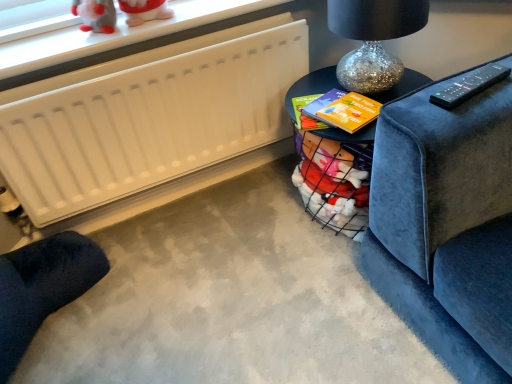
Describe the element at coordinates (312, 86) in the screenshot. I see `matte black table at upper right, which is the first table from back to front` at that location.

At what (x,y) coordinates should I click in order to perform the action: click on black glossy table at center, the first table in the front-to-back sequence. Please return your answer as a coordinate pair (x, y). Looking at the image, I should click on (312, 86).

Describe the element at coordinates (312, 86) in the screenshot. I see `black glossy table at center, the first table in the front-to-back sequence` at that location.

In order to face sparkly glass table lamp at upper right, should I rotate leftwards or rightwards?

You should look right and rotate roughly 15.676 degrees.

The image size is (512, 384). Find the location of `matte black table at upper right, which is the second table from front to back`. matte black table at upper right, which is the second table from front to back is located at coordinates (312, 86).

Consider the image. Can you tell me how much black glossy table at center, the first table in the front-to-back sequence, and matte black table at upper right, which is the second table from front to back, differ in facing direction?

black glossy table at center, the first table in the front-to-back sequence, and matte black table at upper right, which is the second table from front to back, are facing 19 degrees away from each other.

Is black glossy table at center, the first table in the front-to-back sequence, outside of matte black table at upper right, which is the second table from front to back?

Yes, black glossy table at center, the first table in the front-to-back sequence, is not within matte black table at upper right, which is the second table from front to back.

Is black glossy table at center, the first table in the front-to-back sequence, bigger or smaller than matte black table at upper right, which is the second table from front to back?

Considering their sizes, black glossy table at center, the first table in the front-to-back sequence, takes up more space than matte black table at upper right, which is the second table from front to back.

Looking at this image, who is more distant, matte black table at upper right, which is the first table from back to front, or black glossy table at center, arranged as the 2th table when viewed from the back?

matte black table at upper right, which is the first table from back to front, is behind.

From the image's perspective, is matte black table at upper right, which is the first table from back to front, located above or below black glossy table at center, the first table in the front-to-back sequence?

Clearly, from the image's perspective, matte black table at upper right, which is the first table from back to front, is above black glossy table at center, the first table in the front-to-back sequence.

Is point (324, 135) closer or farther from the camera than point (404, 81)?

Point (324, 135).

Where is `table in front of the matte black table at upper right, which is the first table from back to front`? The height and width of the screenshot is (384, 512). table in front of the matte black table at upper right, which is the first table from back to front is located at coordinates (312, 86).

Consider the image. Considering the relative positions of dark blue fabric footrest at lower left and white matte radiator at upper left in the image provided, is dark blue fabric footrest at lower left in front of white matte radiator at upper left?

Yes, it is in front of white matte radiator at upper left.

Which is closer, (51,252) or (228,102)?

Point (51,252).

Considering the relative sizes of dark blue fabric footrest at lower left and white matte radiator at upper left in the image provided, is dark blue fabric footrest at lower left smaller than white matte radiator at upper left?

Incorrect, dark blue fabric footrest at lower left is not smaller in size than white matte radiator at upper left.

Which object is thinner, sparkly glass table lamp at upper right or matte black table at upper right, which is the first table from back to front?

Thinner between the two is matte black table at upper right, which is the first table from back to front.

Between sparkly glass table lamp at upper right and matte black table at upper right, which is the second table from front to back, which one is positioned behind?

Positioned behind is matte black table at upper right, which is the second table from front to back.

From a real-world perspective, is sparkly glass table lamp at upper right physically below matte black table at upper right, which is the first table from back to front?

No, from a real-world perspective, sparkly glass table lamp at upper right is not beneath matte black table at upper right, which is the first table from back to front.

Is point (79, 278) positioned after point (373, 139)?

Yes, point (79, 278) is farther from viewer.

From a real-world perspective, relative to black glossy table at center, arranged as the 2th table when viewed from the back, is dark blue fabric footrest at lower left vertically above or below?

Clearly, from a real-world perspective, dark blue fabric footrest at lower left is above black glossy table at center, arranged as the 2th table when viewed from the back.

Where is `table that appears below the dark blue fabric footrest at lower left (from a real-world perspective)`? table that appears below the dark blue fabric footrest at lower left (from a real-world perspective) is located at coordinates (312, 86).

Consider the image. How different are the orientations of dark blue fabric footrest at lower left and black glossy table at center, arranged as the 2th table when viewed from the back, in degrees?

dark blue fabric footrest at lower left and black glossy table at center, arranged as the 2th table when viewed from the back, are facing 146 degrees away from each other.

Can we say white matte radiator at upper left lies outside sparkly glass table lamp at upper right?

Yes, white matte radiator at upper left is located beyond the bounds of sparkly glass table lamp at upper right.

Where is `radiator behind the sparkly glass table lamp at upper right`? The image size is (512, 384). radiator behind the sparkly glass table lamp at upper right is located at coordinates (149, 117).

Who is shorter, white matte radiator at upper left or sparkly glass table lamp at upper right?

sparkly glass table lamp at upper right.

Which of these two, sparkly glass table lamp at upper right or black glossy table at center, the first table in the front-to-back sequence, stands shorter?

sparkly glass table lamp at upper right.

Is sparkly glass table lamp at upper right far away from black glossy table at center, arranged as the 2th table when viewed from the back?

No, sparkly glass table lamp at upper right is in close proximity to black glossy table at center, arranged as the 2th table when viewed from the back.

Is sparkly glass table lamp at upper right facing away from black glossy table at center, arranged as the 2th table when viewed from the back?

No, black glossy table at center, arranged as the 2th table when viewed from the back, is not at the back of sparkly glass table lamp at upper right.

How much distance is there between sparkly glass table lamp at upper right and black glossy table at center, arranged as the 2th table when viewed from the back?

sparkly glass table lamp at upper right and black glossy table at center, arranged as the 2th table when viewed from the back, are 14.91 centimeters apart.

What are the coordinates of `table in front of the matte black table at upper right, which is the second table from front to back` in the screenshot? It's located at (312, 86).

Identify the location of table above the black glossy table at center, the first table in the front-to-back sequence (from the image's perspective). (312, 86).

Which object lies nearer to the anchor point dark blue fabric footrest at lower left, matte black table at upper right, which is the second table from front to back, or sparkly glass table lamp at upper right?

matte black table at upper right, which is the second table from front to back, is positioned closer to the anchor dark blue fabric footrest at lower left.

When comparing their distances from black glossy table at center, arranged as the 2th table when viewed from the back, does sparkly glass table lamp at upper right or dark blue fabric footrest at lower left seem closer?

The object closer to black glossy table at center, arranged as the 2th table when viewed from the back, is sparkly glass table lamp at upper right.

Estimate the real-world distances between objects in this image. Which object is closer to matte black table at upper right, which is the first table from back to front, white matte radiator at upper left or black glossy table at center, the first table in the front-to-back sequence?

Based on the image, black glossy table at center, the first table in the front-to-back sequence, appears to be nearer to matte black table at upper right, which is the first table from back to front.

Estimate the real-world distances between objects in this image. Which object is closer to black glossy table at center, the first table in the front-to-back sequence, white matte radiator at upper left or matte black table at upper right, which is the first table from back to front?

matte black table at upper right, which is the first table from back to front, lies closer to black glossy table at center, the first table in the front-to-back sequence, than the other object.

Which object lies further to the anchor point white matte radiator at upper left, black glossy table at center, the first table in the front-to-back sequence, or dark blue fabric footrest at lower left?

black glossy table at center, the first table in the front-to-back sequence, is further to white matte radiator at upper left.

Looking at the image, which one is located closer to dark blue fabric footrest at lower left, black glossy table at center, the first table in the front-to-back sequence, or matte black table at upper right, which is the second table from front to back?

Among the two, matte black table at upper right, which is the second table from front to back, is located nearer to dark blue fabric footrest at lower left.

Consider the image. From the image, which object appears to be nearer to black glossy table at center, the first table in the front-to-back sequence, sparkly glass table lamp at upper right or matte black table at upper right, which is the second table from front to back?

The object closer to black glossy table at center, the first table in the front-to-back sequence, is matte black table at upper right, which is the second table from front to back.

When comparing their distances from black glossy table at center, the first table in the front-to-back sequence, does sparkly glass table lamp at upper right or white matte radiator at upper left seem further?

white matte radiator at upper left is further to black glossy table at center, the first table in the front-to-back sequence.

You are a GUI agent. You are given a task and a screenshot of the screen. Output one action in this format:
    pyautogui.click(x=<x>, y=<y>)
    Task: Click on the table between sparkly glass table lamp at upper right and black glossy table at center, arranged as the 2th table when viewed from the back, vertically
    This screenshot has height=384, width=512.
    Given the screenshot: What is the action you would take?
    pyautogui.click(x=312, y=86)

Locate an element on the screen. radiator located between dark blue fabric footrest at lower left and sparkly glass table lamp at upper right in the left-right direction is located at coordinates (149, 117).

You are a GUI agent. You are given a task and a screenshot of the screen. Output one action in this format:
    pyautogui.click(x=<x>, y=<y>)
    Task: Click on the table located between white matte radiator at upper left and black glossy table at center, the first table in the front-to-back sequence, in the left-right direction
    This screenshot has height=384, width=512.
    Given the screenshot: What is the action you would take?
    pyautogui.click(x=312, y=86)

In order to click on radiator between dark blue fabric footrest at lower left and black glossy table at center, the first table in the front-to-back sequence, from left to right in this screenshot , I will do `click(149, 117)`.